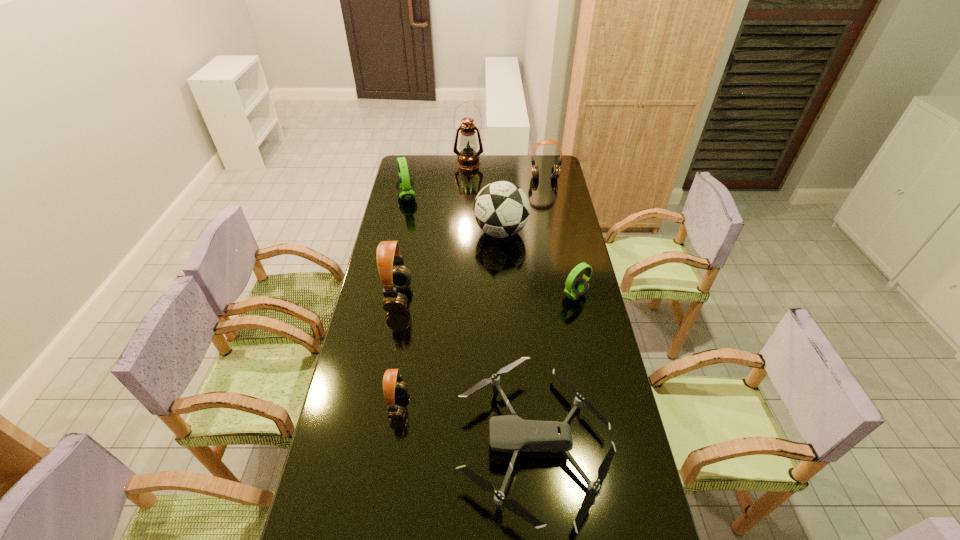
Find the location of a particular element. This screenshot has height=540, width=960. free space located on the ear cups of the rightmost brown headset is located at coordinates (547, 191).

I want to click on free space located on the left of the nearer green headset, so click(486, 295).

Where is `free point located 0.070m on the ear cups of the nearest brown headset`? free point located 0.070m on the ear cups of the nearest brown headset is located at coordinates (430, 406).

Image resolution: width=960 pixels, height=540 pixels. Find the location of `oil lamp at the far edge`. oil lamp at the far edge is located at coordinates (468, 158).

You are a GUI agent. You are given a task and a screenshot of the screen. Output one action in this format:
    pyautogui.click(x=<x>, y=<y>)
    Task: Click on the headset at the far edge
    The width and height of the screenshot is (960, 540).
    Given the screenshot: What is the action you would take?
    pyautogui.click(x=555, y=170)

Identify the location of object that is at the far right corner. This screenshot has width=960, height=540. (555, 170).

The image size is (960, 540). In order to click on vacant region at the far edge of the desktop in this screenshot , I will do `click(497, 156)`.

Locate an element on the screen. This screenshot has width=960, height=540. vacant region at the left edge of the desktop is located at coordinates (384, 417).

This screenshot has width=960, height=540. In the image, there is a desktop. Identify the location of vacant space at the right edge. point(539,181).

Locate an element on the screen. free space at the far left corner of the desktop is located at coordinates (430, 155).